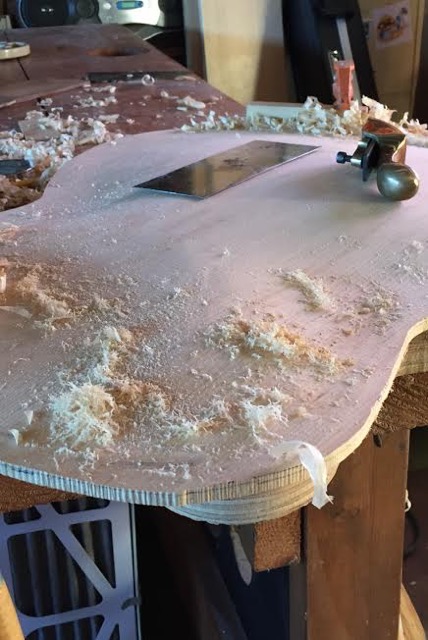
This screenshot has width=428, height=640. In order to click on blue plastic item under table in this screenshot , I will do `click(116, 596)`.